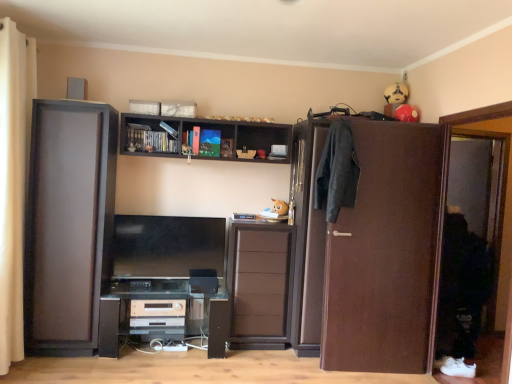
The height and width of the screenshot is (384, 512). I want to click on vacant space in dark gray fabric coat at right (from a real-world perspective), so click(320, 368).